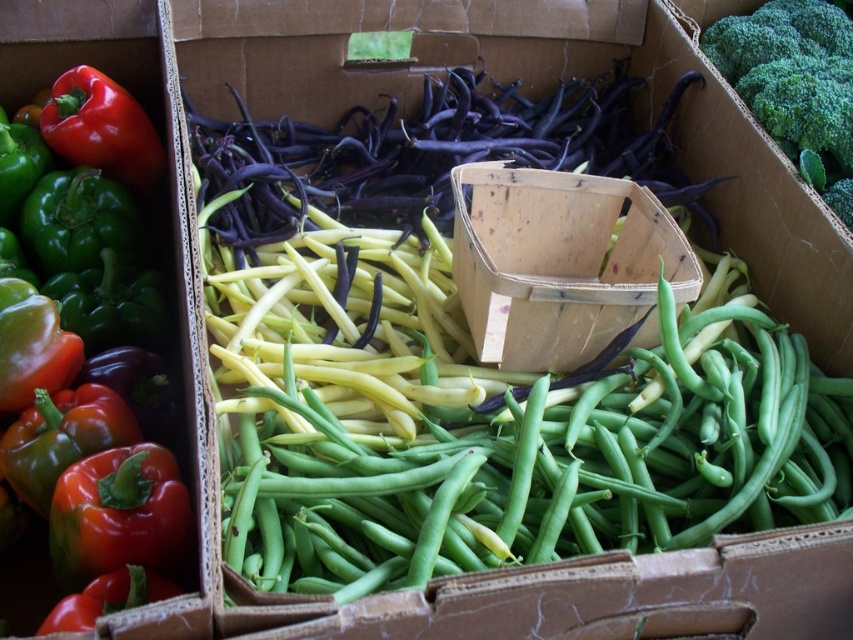
You are a grocery store employee arranging vegetables. You need to stack the green matte bell pepper at left and the green leafy broccoli at upper right vertically on a shelf. Which one should you place at the bottom to ensure stability?

You should place the green matte bell pepper at left at the bottom because it has a greater height than the green leafy broccoli at upper right, providing a more stable base.

You are a grocery store employee who needs to locate the green matte bell pepper at left. According to the image coordinates, where exactly is it positioned?

The green matte bell pepper at left is positioned at coordinates point (x=80, y=273).